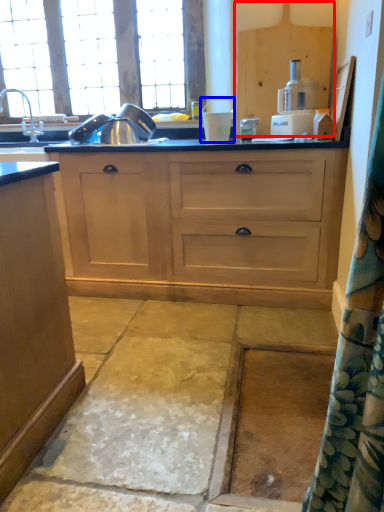
Question: Which object is closer to the camera taking this photo, cabinetry (highlighted by a red box) or appliance (highlighted by a blue box)?

Choices:
 (A) cabinetry
 (B) appliance

Answer: (B)